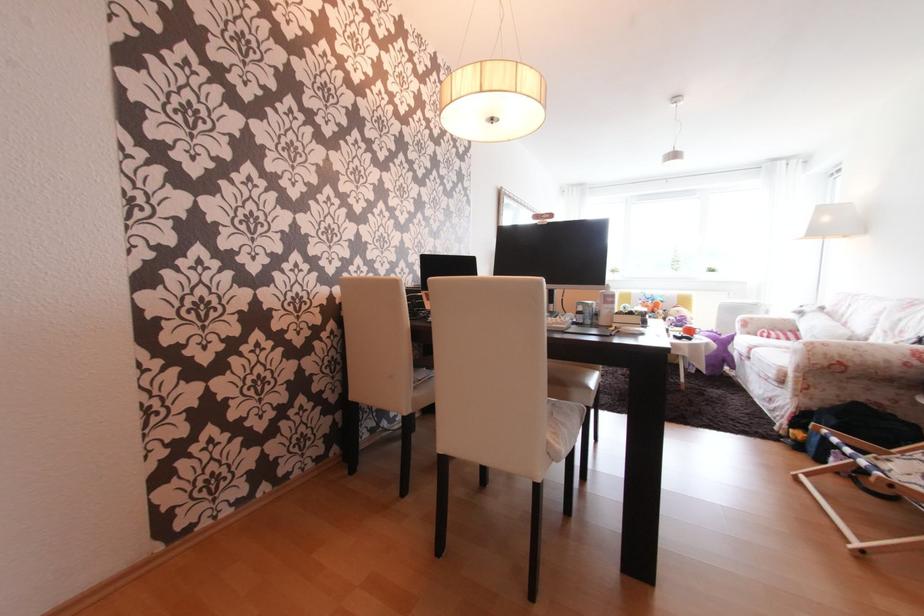
I want to click on white chair sitting surface, so click(564, 419).